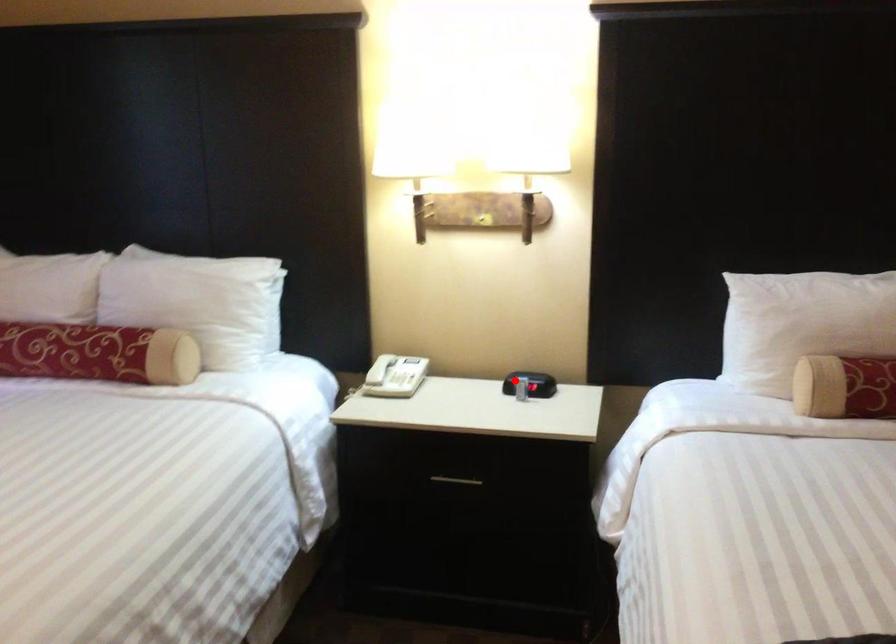
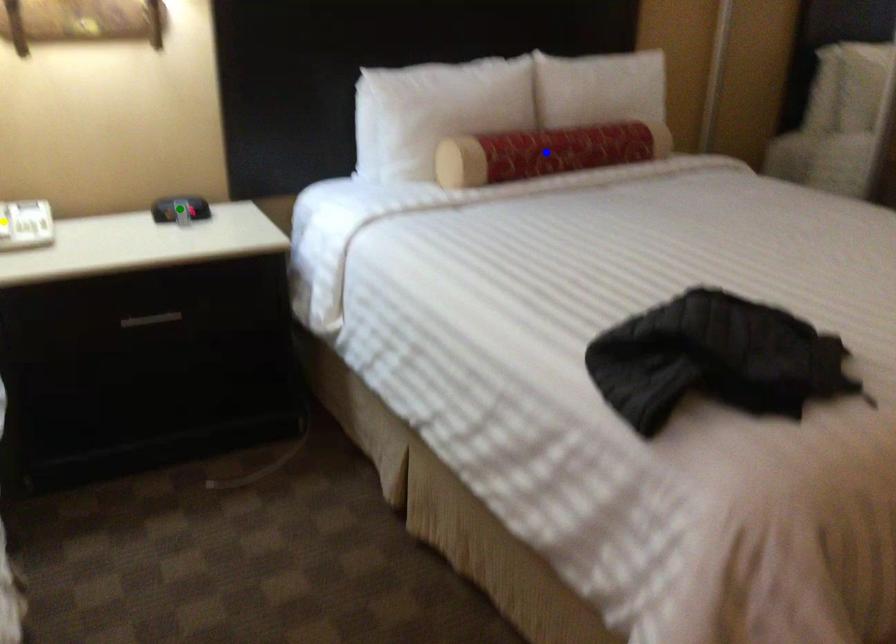
Question: I am providing you with two images of the same scene from different viewpoints. A red point is marked on the first image. You are given multiple points on the second image. Which spot in image 2 lines up with the point in image 1?

Choices:
 (A) green point
 (B) blue point
 (C) yellow point

Answer: (A)